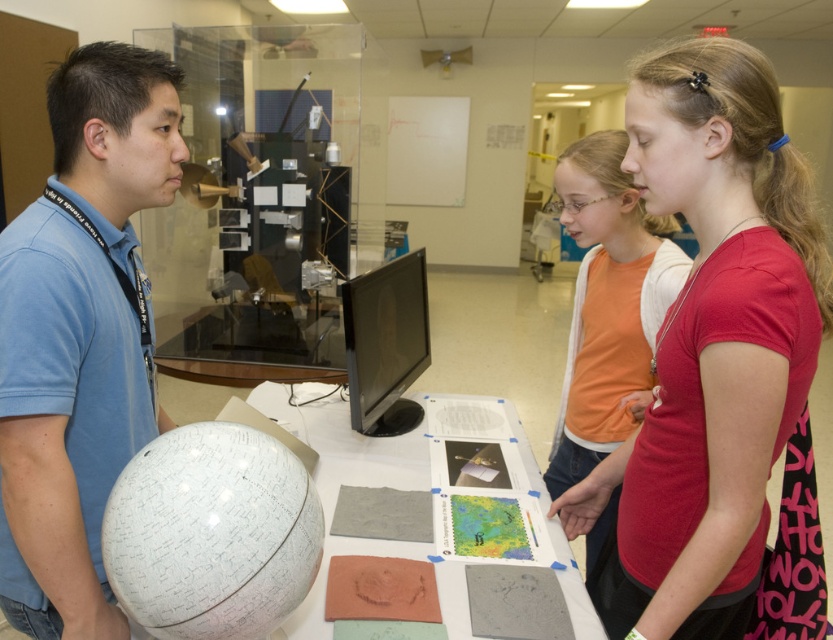
Can you confirm if matte red shirt at center is positioned to the left of matte orange shirt at center?

Yes, matte red shirt at center is to the left of matte orange shirt at center.

Where is `matte red shirt at center`? matte red shirt at center is located at coordinates (711, 348).

What do you see at coordinates (80, 336) in the screenshot? This screenshot has width=833, height=640. I see `white matte globe at left` at bounding box center [80, 336].

Is white matte globe at left wider than matte orange shirt at center?

No.

Between point (93, 579) and point (651, 358), which one is positioned behind?

Point (651, 358)

At what (x,y) coordinates should I click in order to perform the action: click on white matte globe at left. Please return your answer as a coordinate pair (x, y). This screenshot has width=833, height=640. Looking at the image, I should click on (80, 336).

Is the position of matte red shirt at center more distant than that of white matte globe at left?

No, matte red shirt at center is in front of white matte globe at left.

Does matte red shirt at center have a smaller size compared to white matte globe at left?

No, matte red shirt at center is not smaller than white matte globe at left.

The width and height of the screenshot is (833, 640). Find the location of `matte red shirt at center`. matte red shirt at center is located at coordinates (711, 348).

Find the location of a particular element. matte red shirt at center is located at coordinates (711, 348).